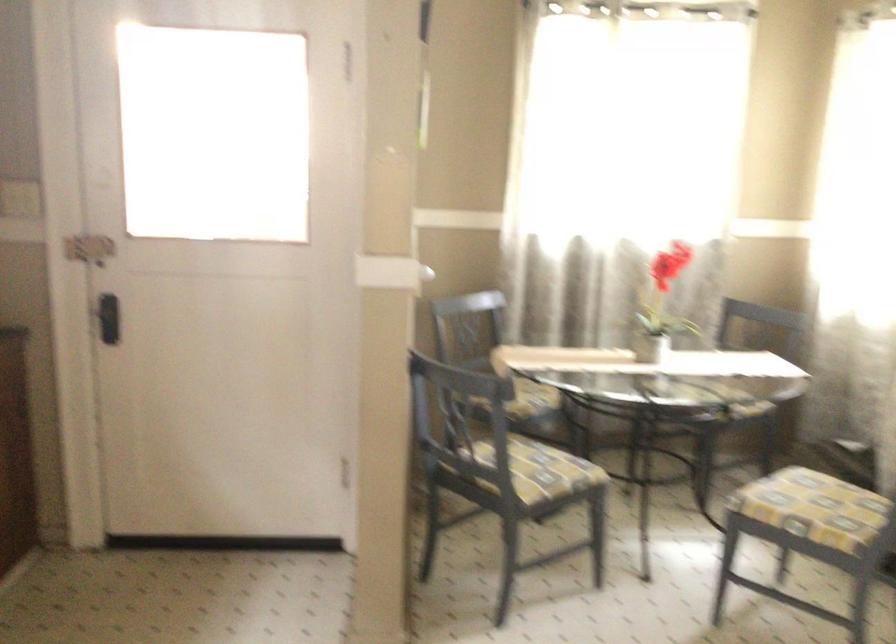
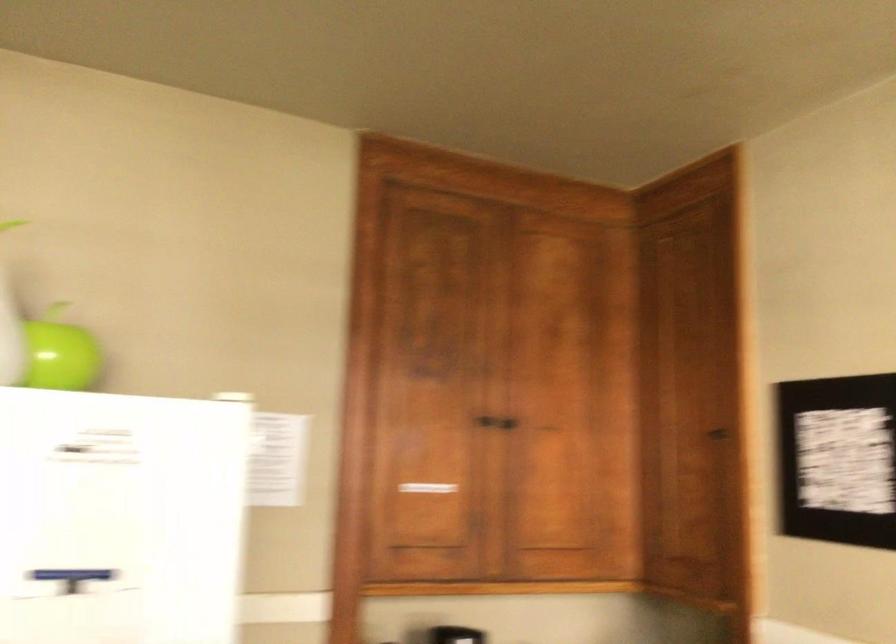
Question: The images are taken continuously from a first-person perspective. In which direction is your viewpoint rotating?

Choices:
 (A) Left
 (B) Right
 (C) Up
 (D) Down

Answer: (B)